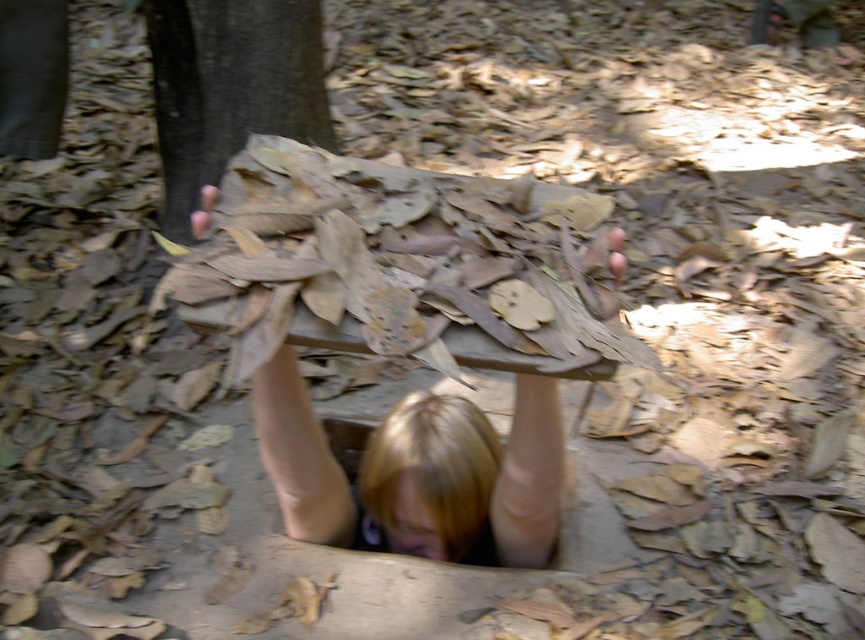
Question: Which point appears closest to the camera in this image?

Choices:
 (A) (620, 246)
 (B) (209, 100)

Answer: (A)

Question: Does brown rough tree trunk at upper left have a lesser width compared to blonde hair at center?

Choices:
 (A) yes
 (B) no

Answer: (A)

Question: Which point appears closest to the camera in this image?

Choices:
 (A) (559, 513)
 (B) (314, 136)

Answer: (A)

Question: Can you confirm if brown rough tree trunk at upper left is bigger than blonde hair at center?

Choices:
 (A) yes
 (B) no

Answer: (B)

Question: Can you confirm if brown rough tree trunk at upper left is positioned above blonde hair at center?

Choices:
 (A) no
 (B) yes

Answer: (B)